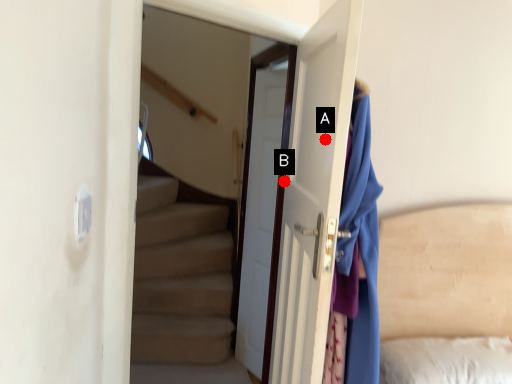
Question: Two points are circled on the image, labeled by A and B beside each circle. Among these points, which one is farthest from the camera?

Choices:
 (A) A is further
 (B) B is further

Answer: (B)